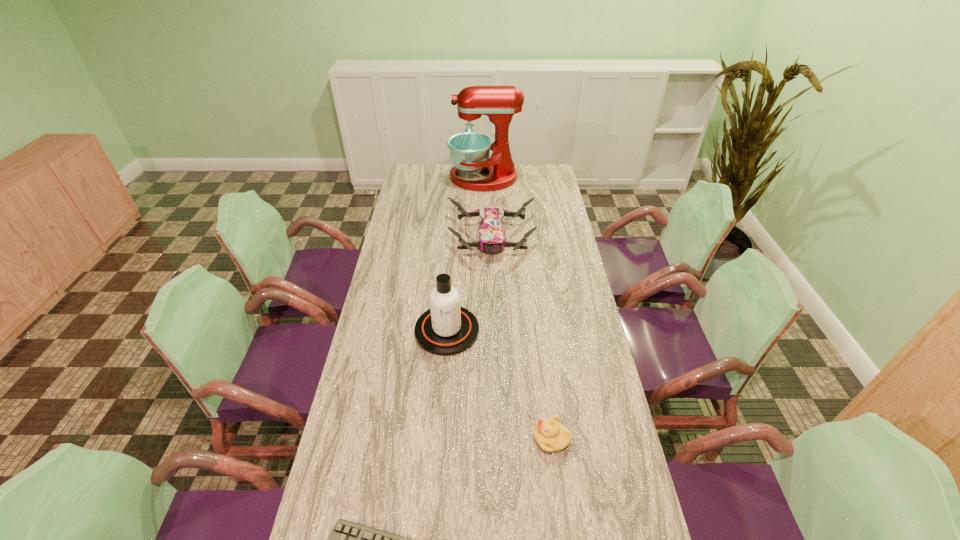
This screenshot has height=540, width=960. I want to click on vacant space at the right edge of the desktop, so click(x=573, y=402).

You are a GUI agent. You are given a task and a screenshot of the screen. Output one action in this format:
    pyautogui.click(x=<x>, y=<y>)
    Task: Click on the free region at the far left corner
    This screenshot has height=540, width=960.
    Given the screenshot: What is the action you would take?
    pyautogui.click(x=409, y=185)

This screenshot has height=540, width=960. I want to click on free space at the far right corner, so click(x=540, y=166).

The height and width of the screenshot is (540, 960). What are the coordinates of `unoccupied position between the duckling and the fourth nearest object` in the screenshot? It's located at (522, 338).

The height and width of the screenshot is (540, 960). Find the location of `vacant area that lies between the third nearest object and the drone`. vacant area that lies between the third nearest object and the drone is located at coordinates (469, 284).

Find the location of `vacant space that's between the duckling and the third shortest object`. vacant space that's between the duckling and the third shortest object is located at coordinates (522, 338).

Choose which object is the fourth nearest neighbor to the farthest object. Please provide its 2D coordinates. Your answer should be formatted as a tuple, i.e. [(x, y)], where the tuple contains the x and y coordinates of a point satisfying the conditions above.

[(347, 539)]

The width and height of the screenshot is (960, 540). In order to click on object that is the third closest to the fourth shortest object in this screenshot , I will do `click(347, 539)`.